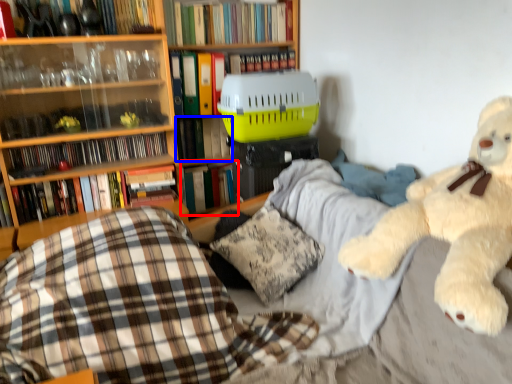
Question: Which point is closer to the camera, book (highlighted by a red box) or book (highlighted by a blue box)?

Choices:
 (A) book
 (B) book

Answer: (B)